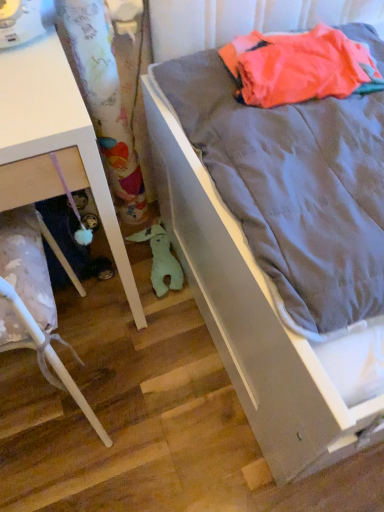
Question: Should I look upward or downward to see gray fabric bed at right?

Choices:
 (A) up
 (B) down

Answer: (A)

Question: Does gray fabric bed at right have a lesser height compared to wooden floor at lower left?

Choices:
 (A) no
 (B) yes

Answer: (A)

Question: Considering the relative positions of gray fabric bed at right and wooden floor at lower left in the image provided, is gray fabric bed at right behind wooden floor at lower left?

Choices:
 (A) yes
 (B) no

Answer: (B)

Question: From a real-world perspective, is gray fabric bed at right located beneath wooden floor at lower left?

Choices:
 (A) yes
 (B) no

Answer: (B)

Question: Is gray fabric bed at right taller than wooden floor at lower left?

Choices:
 (A) no
 (B) yes

Answer: (B)

Question: From the image's perspective, does gray fabric bed at right appear higher than wooden floor at lower left?

Choices:
 (A) yes
 (B) no

Answer: (A)

Question: Is gray fabric bed at right beside wooden floor at lower left?

Choices:
 (A) no
 (B) yes

Answer: (A)

Question: Is green plush toy at lower center outside of white glossy drawer at lower left, the first furniture in the top-to-bottom sequence?

Choices:
 (A) yes
 (B) no

Answer: (A)

Question: Is green plush toy at lower center with white glossy drawer at lower left, the 2th furniture in the bottom-to-top sequence?

Choices:
 (A) no
 (B) yes

Answer: (A)

Question: Can you confirm if green plush toy at lower center is bigger than white glossy drawer at lower left, the first furniture in the top-to-bottom sequence?

Choices:
 (A) yes
 (B) no

Answer: (B)

Question: Does green plush toy at lower center appear on the right side of white glossy drawer at lower left, the 2th furniture in the bottom-to-top sequence?

Choices:
 (A) no
 (B) yes

Answer: (B)

Question: Does green plush toy at lower center have a lesser width compared to white glossy drawer at lower left, the 2th furniture in the bottom-to-top sequence?

Choices:
 (A) no
 (B) yes

Answer: (B)

Question: From a real-world perspective, is green plush toy at lower center located beneath white glossy drawer at lower left, the first furniture in the top-to-bottom sequence?

Choices:
 (A) yes
 (B) no

Answer: (A)

Question: Considering the relative positions of white glossy drawer at lower left, which is counted as the first furniture, starting from the bottom, and green plush toy at lower center in the image provided, is white glossy drawer at lower left, which is counted as the first furniture, starting from the bottom, to the left of green plush toy at lower center from the viewer's perspective?

Choices:
 (A) no
 (B) yes

Answer: (B)